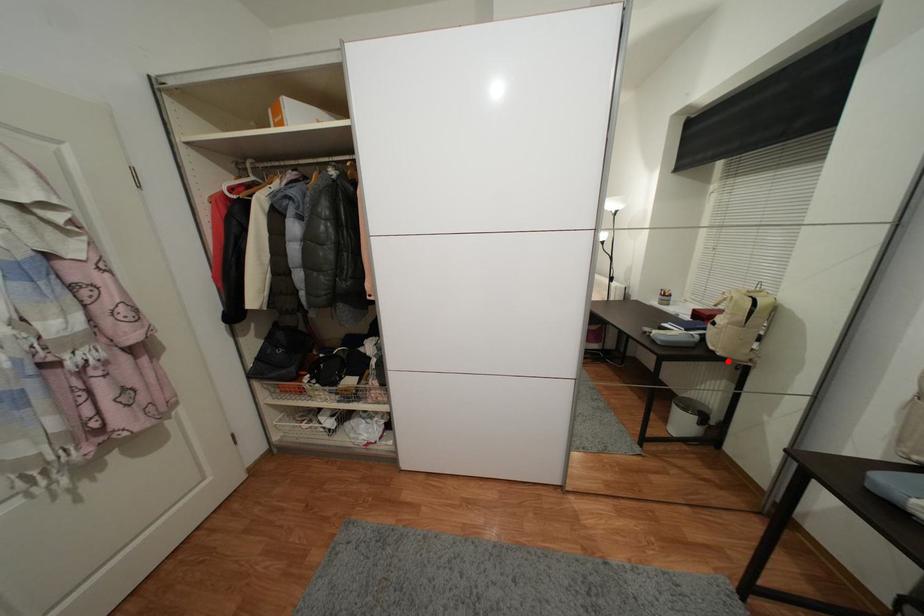
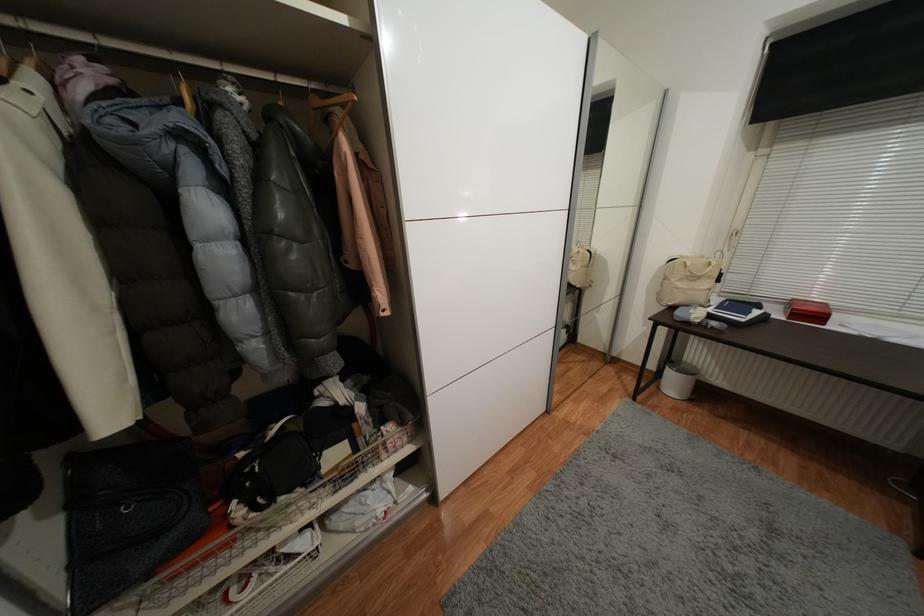
Question: A red point is marked in image1. In image2, is the corresponding 3D point closer to the camera or farther? Reply with the corresponding letter.

Choices:
 (A) The corresponding 3D point is closer.
 (B) The corresponding 3D point is farther.

Answer: (B)